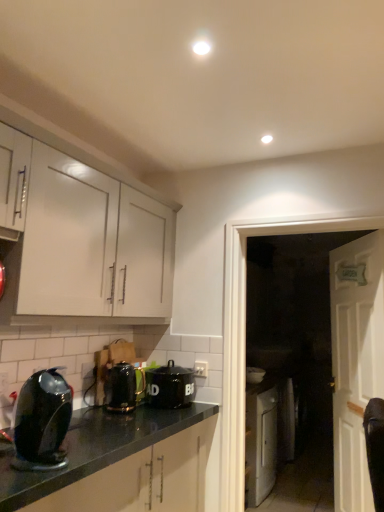
What do you see at coordinates (355, 362) in the screenshot? I see `white wooden door at right` at bounding box center [355, 362].

What is the approximate height of shiny black kettle at lower left, which ranks as the first kitchen appliance in front-to-back order?

shiny black kettle at lower left, which ranks as the first kitchen appliance in front-to-back order, is 12.55 inches in height.

What do you see at coordinates (170, 386) in the screenshot? This screenshot has height=512, width=384. I see `black ceramic canister at center, the 3th kitchen appliance positioned from the front` at bounding box center [170, 386].

The image size is (384, 512). What do you see at coordinates (85, 238) in the screenshot?
I see `white glossy cabinet at upper left` at bounding box center [85, 238].

What is the approximate height of metallic black kettle at lower center, the second kitchen appliance viewed from the left?

It is 10.64 inches.

Where is `white wooden door at right`? white wooden door at right is located at coordinates (355, 362).

Is point (331, 224) positioned before point (176, 390)?

No.

Looking at this image, considering the relative sizes of white glossy door at right and black ceramic canister at center, the first kitchen appliance viewed from the back, in the image provided, is white glossy door at right smaller than black ceramic canister at center, the first kitchen appliance viewed from the back,?

Actually, white glossy door at right might be larger than black ceramic canister at center, the first kitchen appliance viewed from the back.

Is white glossy door at right to the left or to the right of black ceramic canister at center, acting as the 1th kitchen appliance starting from the right, in the image?

white glossy door at right is positioned on black ceramic canister at center, acting as the 1th kitchen appliance starting from the right,'s right side.

Is white wooden door at right in contact with shiny black kettle at lower left, acting as the 1th kitchen appliance starting from the left?

No, white wooden door at right is not making contact with shiny black kettle at lower left, acting as the 1th kitchen appliance starting from the left.

Visually, is white wooden door at right positioned to the left or to the right of shiny black kettle at lower left, which ranks as the first kitchen appliance in front-to-back order?

In the image, white wooden door at right appears on the right side of shiny black kettle at lower left, which ranks as the first kitchen appliance in front-to-back order.

From a real-world perspective, is white wooden door at right above or below shiny black kettle at lower left, which ranks as the first kitchen appliance in front-to-back order?

white wooden door at right is situated lower than shiny black kettle at lower left, which ranks as the first kitchen appliance in front-to-back order, in the real world.

Is white wooden door at right taller than white glossy door at right?

Yes.

From a real-world perspective, is white wooden door at right beneath white glossy door at right?

Yes, from a real-world perspective, white wooden door at right is under white glossy door at right.

Visually, is white wooden door at right positioned to the left or to the right of white glossy door at right?

Clearly, white wooden door at right is on the right of white glossy door at right in the image.

At what (x,y) coordinates should I click in order to perform the action: click on glass door above the white wooden door at right (from the image's perspective). Please return your answer as a coordinate pair (x, y). The height and width of the screenshot is (512, 384). Looking at the image, I should click on (245, 335).

Considering their positions, is white glossy cabinet at upper left located in front of or behind shiny black kettle at lower left, acting as the 1th kitchen appliance starting from the left?

white glossy cabinet at upper left is behind shiny black kettle at lower left, acting as the 1th kitchen appliance starting from the left.

Considering the sizes of objects white glossy cabinet at upper left and shiny black kettle at lower left, which ranks as the first kitchen appliance in front-to-back order, in the image provided, who is thinner, white glossy cabinet at upper left or shiny black kettle at lower left, which ranks as the first kitchen appliance in front-to-back order,?

Thinner between the two is shiny black kettle at lower left, which ranks as the first kitchen appliance in front-to-back order.

From their relative heights in the image, would you say white glossy cabinet at upper left is taller or shorter than shiny black kettle at lower left, acting as the 1th kitchen appliance starting from the left?

Considering their sizes, white glossy cabinet at upper left has more height than shiny black kettle at lower left, acting as the 1th kitchen appliance starting from the left.

From a real-world perspective, which is physically above, white glossy cabinet at upper left or shiny black kettle at lower left, which ranks as the first kitchen appliance in front-to-back order?

white glossy cabinet at upper left, from a real-world perspective.

Does metallic black kettle at lower center, the second kitchen appliance when ordered from back to front, lie in front of white glossy cabinet at upper left?

No, the depth of metallic black kettle at lower center, the second kitchen appliance when ordered from back to front, is greater than that of white glossy cabinet at upper left.

From the image's perspective, is metallic black kettle at lower center, the second kitchen appliance viewed from the left, on white glossy cabinet at upper left?

Actually, metallic black kettle at lower center, the second kitchen appliance viewed from the left, appears below white glossy cabinet at upper left in the image.

Is metallic black kettle at lower center, positioned as the second kitchen appliance in right-to-left order, at the right side of white glossy cabinet at upper left?

Correct, you'll find metallic black kettle at lower center, positioned as the second kitchen appliance in right-to-left order, to the right of white glossy cabinet at upper left.

Based on their sizes in the image, would you say metallic black kettle at lower center, the second kitchen appliance when ordered from back to front, is bigger or smaller than white glossy cabinet at upper left?

Clearly, metallic black kettle at lower center, the second kitchen appliance when ordered from back to front, is smaller in size than white glossy cabinet at upper left.

Is white wooden door at right turned away from metallic black kettle at lower center, arranged as the 2th kitchen appliance when viewed from the front?

No, metallic black kettle at lower center, arranged as the 2th kitchen appliance when viewed from the front, is not at the back of white wooden door at right.

Identify the location of door on the right of metallic black kettle at lower center, the second kitchen appliance viewed from the left. Image resolution: width=384 pixels, height=512 pixels. (355, 362).

What's the angular difference between white wooden door at right and metallic black kettle at lower center, arranged as the 2th kitchen appliance when viewed from the front,'s facing directions?

They differ by 157 degrees in their facing directions.

Looking at this image, from a real-world perspective, who is located higher, white wooden door at right or metallic black kettle at lower center, the second kitchen appliance when ordered from back to front?

In real-world perspective, metallic black kettle at lower center, the second kitchen appliance when ordered from back to front, is above.

From a real-world perspective, is black ceramic canister at center, placed as the 3th kitchen appliance when sorted from left to right, above or below shiny black kettle at lower left, positioned as the 3th kitchen appliance in right-to-left order?

black ceramic canister at center, placed as the 3th kitchen appliance when sorted from left to right, is below shiny black kettle at lower left, positioned as the 3th kitchen appliance in right-to-left order.

From the image's perspective, is black ceramic canister at center, acting as the 1th kitchen appliance starting from the right, positioned above or below shiny black kettle at lower left, which ranks as the first kitchen appliance in front-to-back order?

From the image's perspective, black ceramic canister at center, acting as the 1th kitchen appliance starting from the right, appears below shiny black kettle at lower left, which ranks as the first kitchen appliance in front-to-back order.

Considering the sizes of objects black ceramic canister at center, the 3th kitchen appliance positioned from the front, and shiny black kettle at lower left, positioned as the 3th kitchen appliance in right-to-left order, in the image provided, who is taller, black ceramic canister at center, the 3th kitchen appliance positioned from the front, or shiny black kettle at lower left, positioned as the 3th kitchen appliance in right-to-left order,?

shiny black kettle at lower left, positioned as the 3th kitchen appliance in right-to-left order.

Image resolution: width=384 pixels, height=512 pixels. I want to click on the 2nd kitchen appliance counting from the left side of the black ceramic canister at center, the first kitchen appliance viewed from the back, so click(x=42, y=421).

This screenshot has width=384, height=512. What are the coordinates of `the 1st kitchen appliance counting from the left side of the white glossy door at right` in the screenshot? It's located at (170, 386).

Find the location of a particular element. The height and width of the screenshot is (512, 384). the 3rd kitchen appliance directly above the white wooden door at right (from a real-world perspective) is located at coordinates (42, 421).

Considering their positions, is shiny black kettle at lower left, acting as the 1th kitchen appliance starting from the left, positioned further to white wooden door at right than white glossy cabinet at upper left?

shiny black kettle at lower left, acting as the 1th kitchen appliance starting from the left, is positioned further to the anchor white wooden door at right.

Looking at the image, which one is located further to metallic black kettle at lower center, arranged as the 2th kitchen appliance when viewed from the front, shiny black kettle at lower left, acting as the 1th kitchen appliance starting from the left, or white glossy cabinet at upper left?

The object further to metallic black kettle at lower center, arranged as the 2th kitchen appliance when viewed from the front, is shiny black kettle at lower left, acting as the 1th kitchen appliance starting from the left.

From the image, which object appears to be nearer to white wooden door at right, metallic black kettle at lower center, arranged as the 2th kitchen appliance when viewed from the front, or black ceramic canister at center, the 3th kitchen appliance positioned from the front?

The object closer to white wooden door at right is black ceramic canister at center, the 3th kitchen appliance positioned from the front.

When comparing their distances from white glossy door at right, does white glossy cabinet at upper left or white wooden door at right seem closer?

Among the two, white wooden door at right is located nearer to white glossy door at right.

Which object lies nearer to the anchor point white wooden door at right, white glossy door at right or white glossy cabinet at upper left?

white glossy door at right lies closer to white wooden door at right than the other object.

From the image, which object appears to be farther from white glossy door at right, black ceramic canister at center, the first kitchen appliance viewed from the back, or white glossy cabinet at upper left?

white glossy cabinet at upper left lies further to white glossy door at right than the other object.

When comparing their distances from white glossy cabinet at upper left, does white wooden door at right or metallic black kettle at lower center, arranged as the 2th kitchen appliance when viewed from the front, seem further?

white wooden door at right.

Considering their positions, is black ceramic canister at center, acting as the 1th kitchen appliance starting from the right, positioned closer to white glossy door at right than metallic black kettle at lower center, the second kitchen appliance viewed from the left?

black ceramic canister at center, acting as the 1th kitchen appliance starting from the right, is positioned closer to the anchor white glossy door at right.

The width and height of the screenshot is (384, 512). I want to click on cabinetry between shiny black kettle at lower left, positioned as the 3th kitchen appliance in right-to-left order, and black ceramic canister at center, acting as the 1th kitchen appliance starting from the right, from front to back, so click(x=85, y=238).

Where is `cabinetry located between shiny black kettle at lower left, the third kitchen appliance when ordered from back to front, and white wooden door at right in the left-right direction`? cabinetry located between shiny black kettle at lower left, the third kitchen appliance when ordered from back to front, and white wooden door at right in the left-right direction is located at coordinates click(x=85, y=238).

Where is `glass door located between metallic black kettle at lower center, arranged as the 2th kitchen appliance when viewed from the front, and white wooden door at right in the left-right direction`? glass door located between metallic black kettle at lower center, arranged as the 2th kitchen appliance when viewed from the front, and white wooden door at right in the left-right direction is located at coordinates (245, 335).

You are a GUI agent. You are given a task and a screenshot of the screen. Output one action in this format:
    pyautogui.click(x=<x>, y=<y>)
    Task: Click on the glass door between white glossy cabinet at upper left and white wooden door at right from left to right
    The width and height of the screenshot is (384, 512).
    Given the screenshot: What is the action you would take?
    pyautogui.click(x=245, y=335)